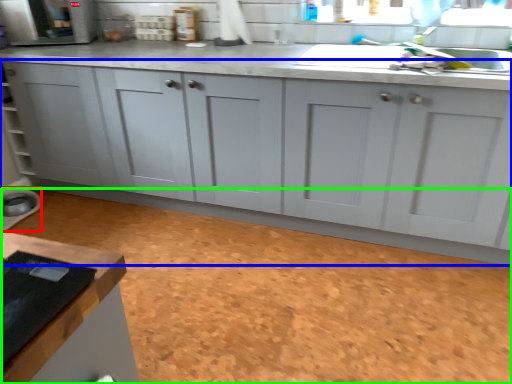
Question: Estimate the real-world distances between objects in this image. Which object is farther from appliance (highlighted by a red box), cabinetry (highlighted by a blue box) or granite (highlighted by a green box)?

Choices:
 (A) cabinetry
 (B) granite

Answer: (B)